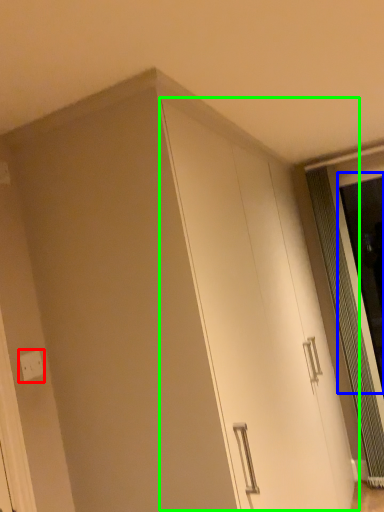
Question: Which object is positioned closest to electric outlet (highlighted by a red box)? Select from screen door (highlighted by a blue box) and cabinetry (highlighted by a green box).

Choices:
 (A) screen door
 (B) cabinetry

Answer: (B)